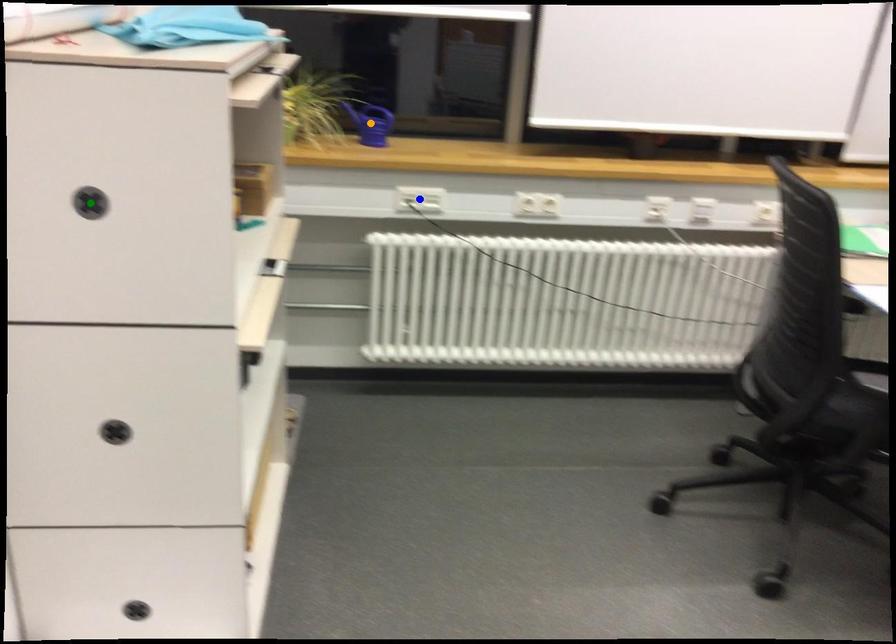
Order these from farthest to nearest:
blue point, green point, orange point

orange point, blue point, green point